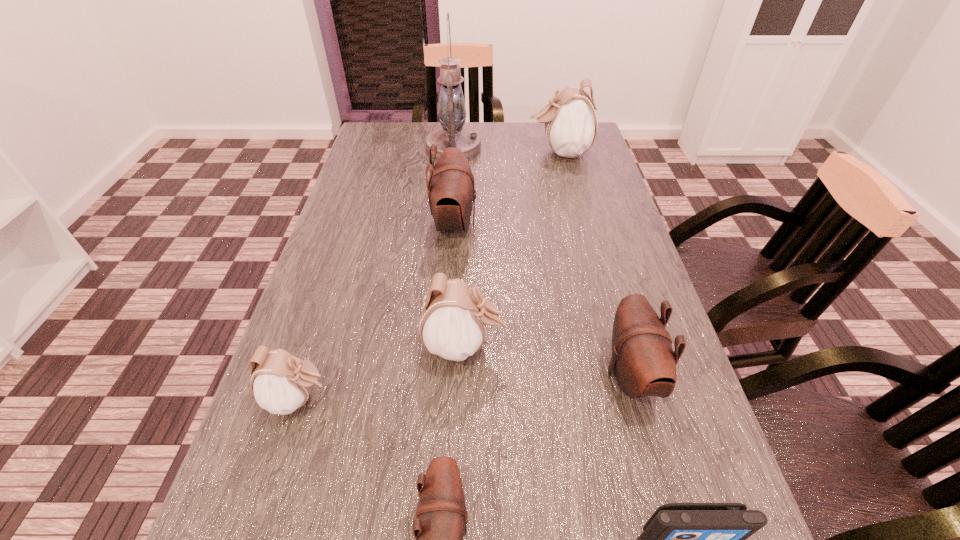
Find the location of a particular element. oil lamp is located at coordinates (452, 114).

Identify the location of the biggest white pouch. (570, 122).

At what (x,y) coordinates should I click in order to perform the action: click on the farthest white pouch. Please return your answer as a coordinate pair (x, y). This screenshot has height=540, width=960. Looking at the image, I should click on (570, 122).

This screenshot has width=960, height=540. Find the location of `the sixth nearest object`. the sixth nearest object is located at coordinates (451, 190).

Locate an element on the screen. The height and width of the screenshot is (540, 960). the farthest brown pouch is located at coordinates [451, 190].

Identify the location of the second white pouch from right to left. click(453, 322).

The width and height of the screenshot is (960, 540). Find the location of `the second nearest brown pouch`. the second nearest brown pouch is located at coordinates (643, 361).

I want to click on the second smallest brown pouch, so click(643, 361).

Locate an element on the screen. The width and height of the screenshot is (960, 540). the leftmost white pouch is located at coordinates (281, 383).

What are the coordinates of `the smallest white pouch` in the screenshot? It's located at (281, 383).